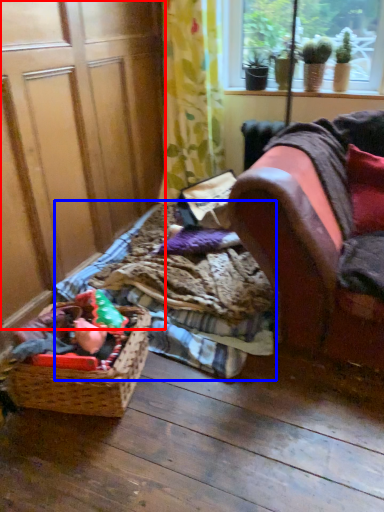
Question: Which object appears farthest to the camera in this image, screen door (highlighted by a red box) or bedding (highlighted by a blue box)?

Choices:
 (A) screen door
 (B) bedding

Answer: (B)